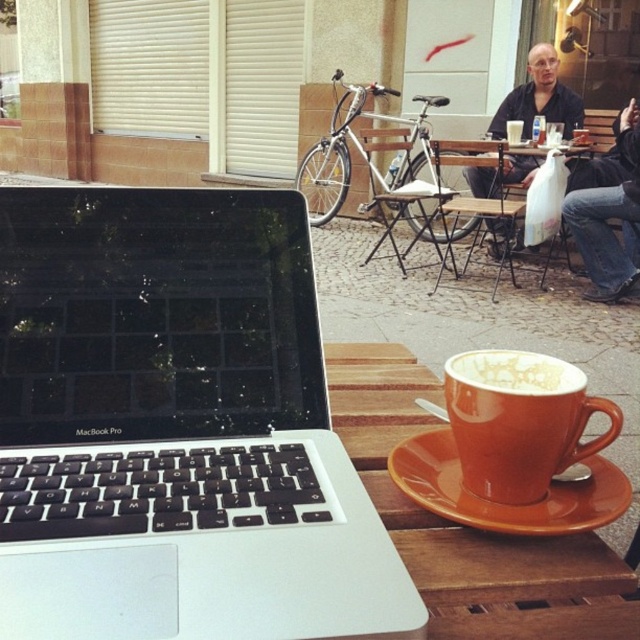
Question: Is silver metallic laptop at center thinner than orange ceramic saucer at lower center?

Choices:
 (A) yes
 (B) no

Answer: (B)

Question: Which is farther from the orange matte mug at lower center?

Choices:
 (A) orange ceramic saucer at lower center
 (B) silver metallic laptop at center

Answer: (B)

Question: Is orange matte mug at lower center smaller than orange ceramic saucer at lower center?

Choices:
 (A) yes
 (B) no

Answer: (B)

Question: Which point is farther to the camera?

Choices:
 (A) silver metallic laptop at center
 (B) orange matte cup at lower right

Answer: (B)

Question: Can you confirm if orange ceramic saucer at lower center is positioned below dark shirt at center?

Choices:
 (A) no
 (B) yes

Answer: (B)

Question: Which of the following is the farthest from the observer?

Choices:
 (A) click(540, 54)
 (B) click(497, 422)

Answer: (A)